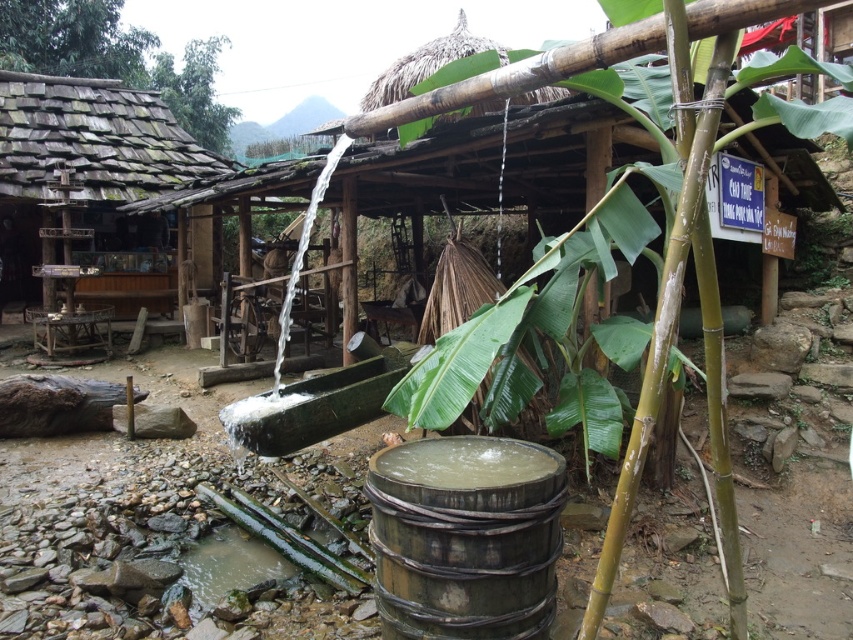
Where is the green bamboo at center located in the image?

The green bamboo at center is located at point (677, 320) in the image.

You are standing in the rustic outdoor setting and want to take a photo. There are two points marked in the scene. Which point, point (631, 483) or point (3, 193), will appear larger in your photo?

Point (631, 483) will appear larger in the photo because it is closer to the camera than point (3, 193).

You are a farmer who needs to transport the wooden barrel at center and the wooden shingles hut at left. Which object requires a wider vehicle to transport?

The wooden shingles hut at left requires a wider vehicle because it is wider than the wooden barrel at center.